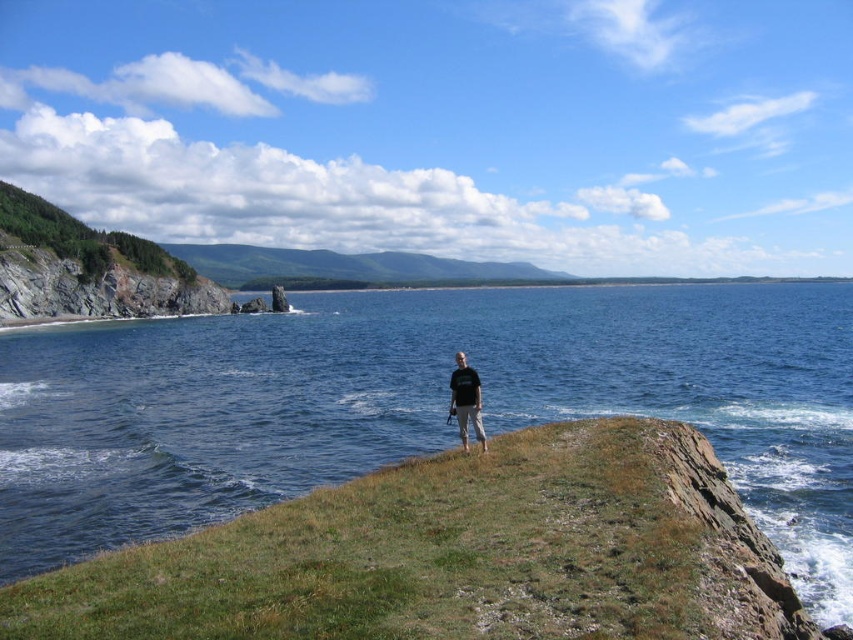
Question: Among these points, which one is nearest to the camera?

Choices:
 (A) (4, 316)
 (B) (465, 356)

Answer: (B)

Question: Which is nearer to the blue water at center?

Choices:
 (A) rocky cliff at left
 (B) black cotton shirt at center

Answer: (A)

Question: Can you confirm if blue water at center is positioned to the right of black cotton shirt at center?

Choices:
 (A) no
 (B) yes

Answer: (B)

Question: Can you confirm if rocky cliff at left is wider than black cotton shirt at center?

Choices:
 (A) yes
 (B) no

Answer: (A)

Question: Does rocky cliff at left appear under black cotton shirt at center?

Choices:
 (A) no
 (B) yes

Answer: (A)

Question: Which object appears closest to the camera in this image?

Choices:
 (A) rocky cliff at left
 (B) black cotton shirt at center
 (C) blue water at center

Answer: (C)